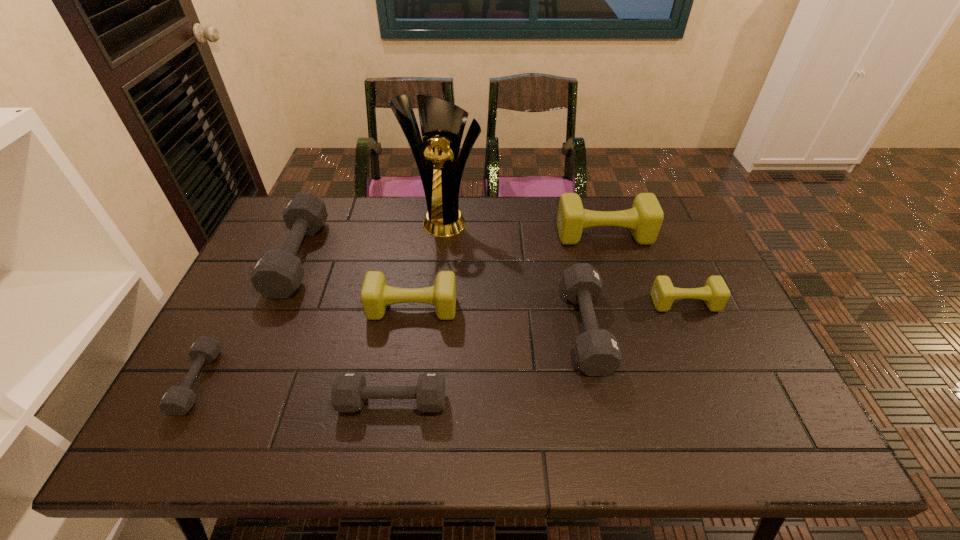
Choose which olive dumbbell is the third nearest neighbor to the rightmost gray dumbbell. Please provide its 2D coordinates. Your answer should be formatted as a tuple, i.e. [(x, y)], where the tuple contains the x and y coordinates of a point satisfying the conditions above.

[(376, 295)]

Identify which olive dumbbell is the second closest to the leftmost gray dumbbell. Please provide its 2D coordinates. Your answer should be formatted as a tuple, i.e. [(x, y)], where the tuple contains the x and y coordinates of a point satisfying the conditions above.

[(645, 218)]

Locate which gray dumbbell ranks in proximity to the second gray dumbbell from right to left. Please provide its 2D coordinates. Your answer should be formatted as a tuple, i.e. [(x, y)], where the tuple contains the x and y coordinates of a point satisfying the conditions above.

[(597, 353)]

Locate which gray dumbbell ranks in proximity to the shortest object. Please provide its 2D coordinates. Your answer should be formatted as a tuple, i.e. [(x, y)], where the tuple contains the x and y coordinates of a point satisfying the conditions above.

[(278, 273)]

Where is `vacant area in the image that satisfies the following two spatial constraints: 1. at the front of the smallest olive dumbbell, where the globe is visible; 2. on the left side of the black award`? vacant area in the image that satisfies the following two spatial constraints: 1. at the front of the smallest olive dumbbell, where the globe is visible; 2. on the left side of the black award is located at coordinates (436, 303).

Identify the location of vacant position in the image that satisfies the following two spatial constraints: 1. on the back side of the leftmost olive dumbbell; 2. on the left side of the second gray dumbbell from right to left. (407, 308).

Identify the location of vacant area in the image that satisfies the following two spatial constraints: 1. on the back side of the shortest object; 2. on the right side of the second object from left to right. The height and width of the screenshot is (540, 960). (262, 257).

Where is `free space in the image that satisfies the following two spatial constraints: 1. on the front side of the second gray dumbbell from left to right; 2. on the left side of the second smallest gray dumbbell`? Image resolution: width=960 pixels, height=540 pixels. free space in the image that satisfies the following two spatial constraints: 1. on the front side of the second gray dumbbell from left to right; 2. on the left side of the second smallest gray dumbbell is located at coordinates coord(236,401).